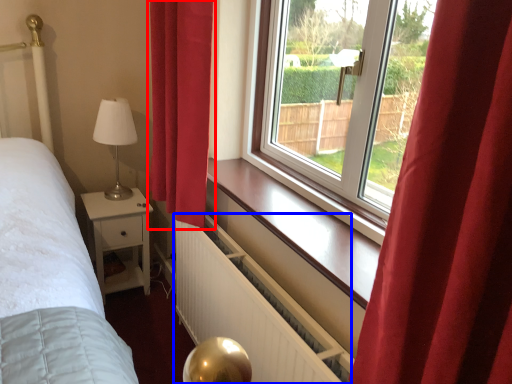
Question: Which of the following is the closest to the observer, curtain (highlighted by a red box) or radiator (highlighted by a blue box)?

Choices:
 (A) curtain
 (B) radiator

Answer: (B)